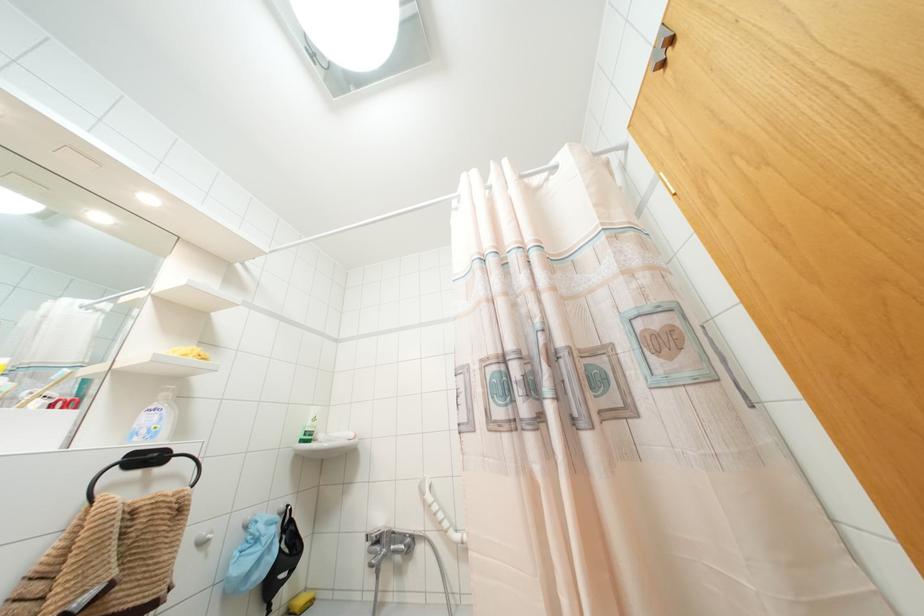
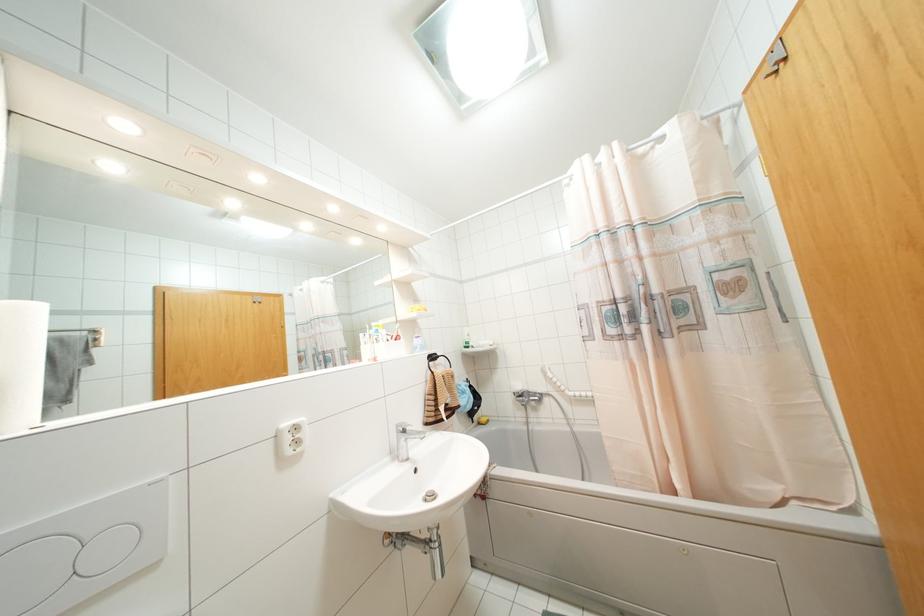
Locate, in the second image, the point that corresponds to (663,63) in the first image.

(775, 71)